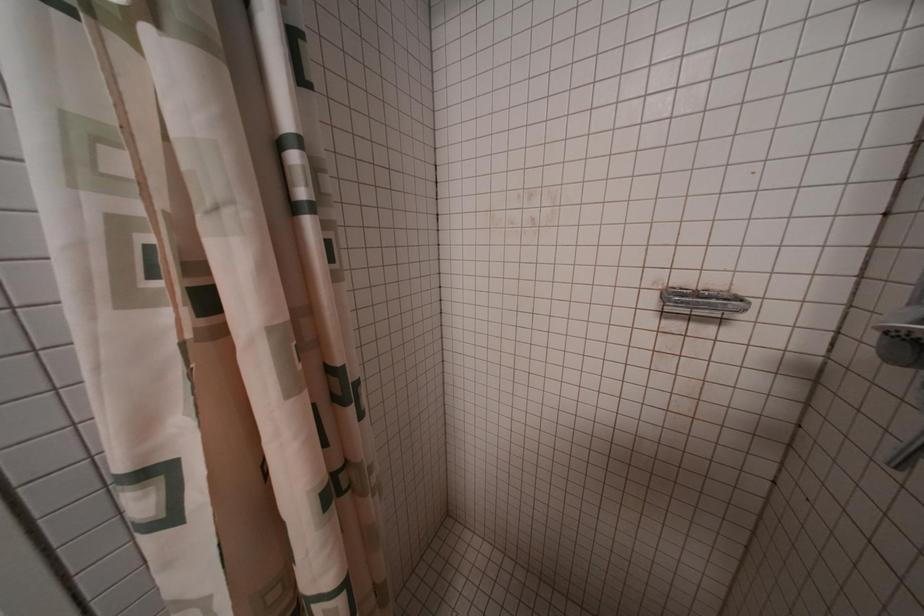
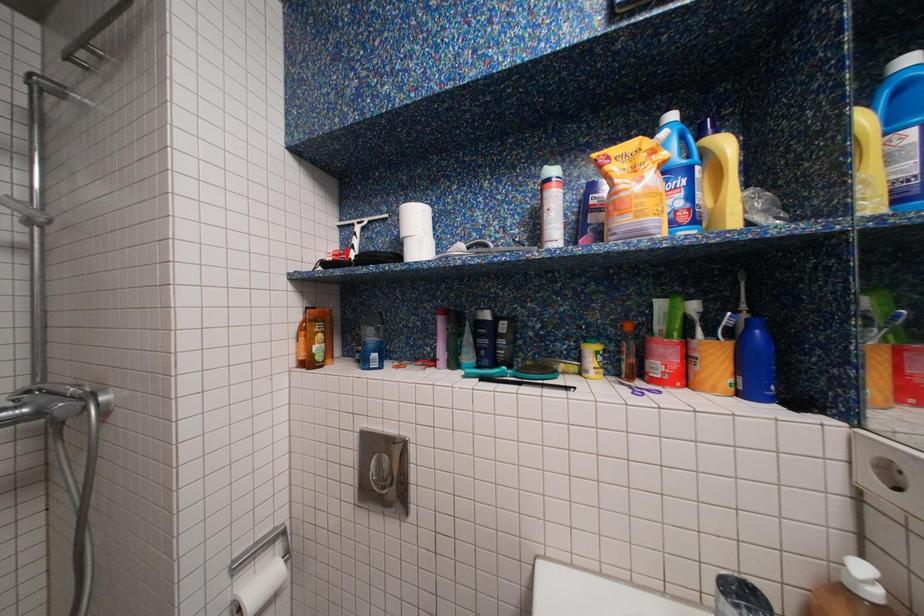
Question: The camera is either moving clockwise (left) or counter-clockwise (right) around the object. The first image is from the beginning of the video and the second image is from the end. Is the camera moving left or right when shooting the video?

Choices:
 (A) Left
 (B) Right

Answer: (A)